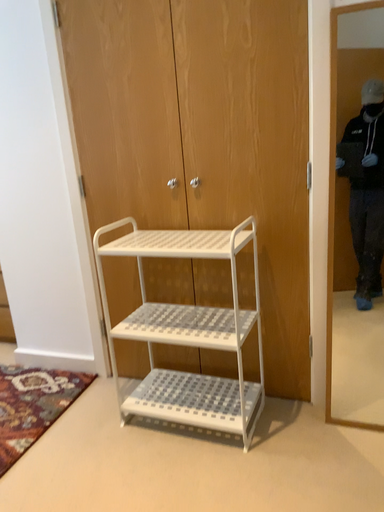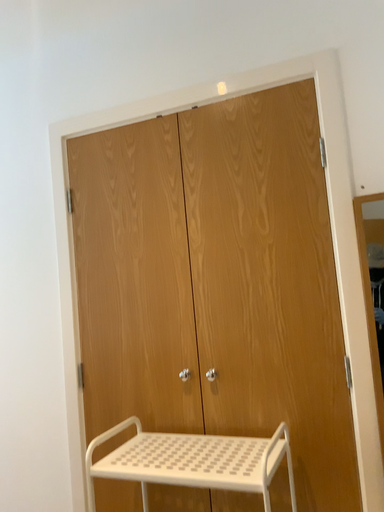
Question: Which way did the camera rotate in the video?

Choices:
 (A) rotated downward
 (B) rotated upward

Answer: (B)